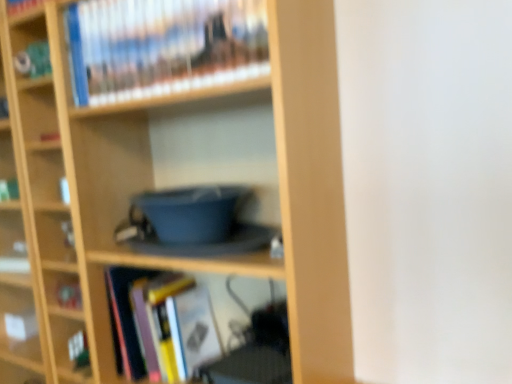
Question: Does hardcover book at upper center, marked as the third book in a bottom-to-top arrangement, lie behind wooden bookcase at center?

Choices:
 (A) no
 (B) yes

Answer: (B)

Question: From the image's perspective, does hardcover book at upper center, marked as the third book in a bottom-to-top arrangement, appear lower than wooden bookcase at center?

Choices:
 (A) yes
 (B) no

Answer: (B)

Question: From a real-world perspective, is hardcover book at upper center, marked as the third book in a bottom-to-top arrangement, positioned under wooden bookcase at center based on gravity?

Choices:
 (A) no
 (B) yes

Answer: (A)

Question: Is hardcover book at upper center, which is counted as the 1th book, starting from the top, thinner than wooden bookcase at center?

Choices:
 (A) no
 (B) yes

Answer: (B)

Question: Is hardcover book at upper center, which is counted as the 1th book, starting from the top, positioned in front of wooden bookcase at center?

Choices:
 (A) no
 (B) yes

Answer: (A)

Question: Does hardcover book at upper center, marked as the third book in a bottom-to-top arrangement, have a larger size compared to wooden bookcase at center?

Choices:
 (A) yes
 (B) no

Answer: (B)

Question: Is wooden bookcase at center facing towards hardcover book at upper center, marked as the third book in a bottom-to-top arrangement?

Choices:
 (A) no
 (B) yes

Answer: (B)

Question: Does wooden bookcase at center appear on the left side of hardcover book at upper center, marked as the third book in a bottom-to-top arrangement?

Choices:
 (A) no
 (B) yes

Answer: (B)

Question: From the image's perspective, would you say wooden bookcase at center is shown under hardcover book at upper center, which is counted as the 1th book, starting from the top?

Choices:
 (A) no
 (B) yes

Answer: (B)

Question: Is wooden bookcase at center directly adjacent to hardcover book at upper center, marked as the third book in a bottom-to-top arrangement?

Choices:
 (A) yes
 (B) no

Answer: (B)

Question: From a real-world perspective, is wooden bookcase at center positioned over hardcover book at upper center, which is counted as the 1th book, starting from the top, based on gravity?

Choices:
 (A) no
 (B) yes

Answer: (A)

Question: Is wooden bookcase at center to the right of hardcover book at upper center, which is counted as the 1th book, starting from the top, from the viewer's perspective?

Choices:
 (A) yes
 (B) no

Answer: (B)

Question: Would you say hardcover book at center, acting as the third book starting from the top, is part of hardcover book at upper center, which is counted as the 1th book, starting from the top,'s contents?

Choices:
 (A) no
 (B) yes

Answer: (A)